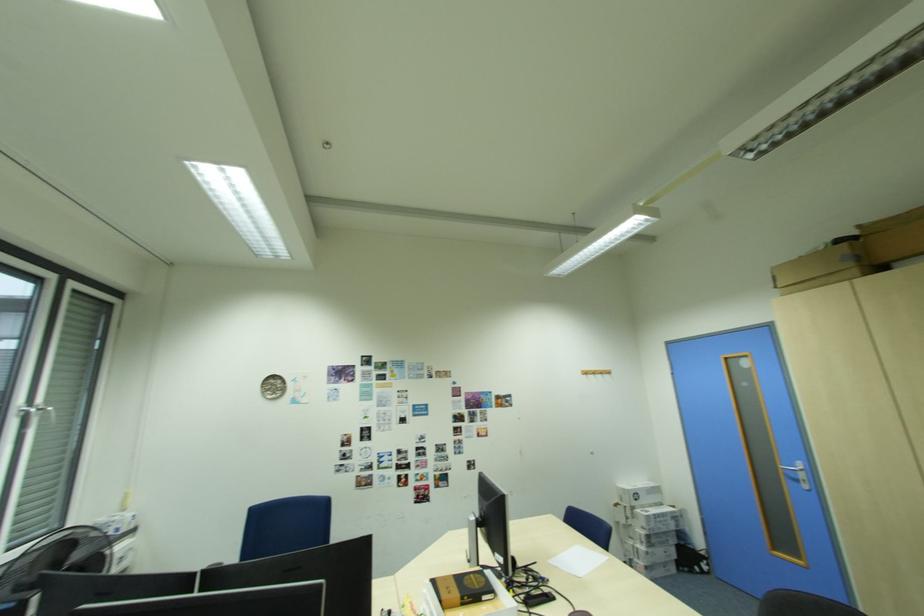
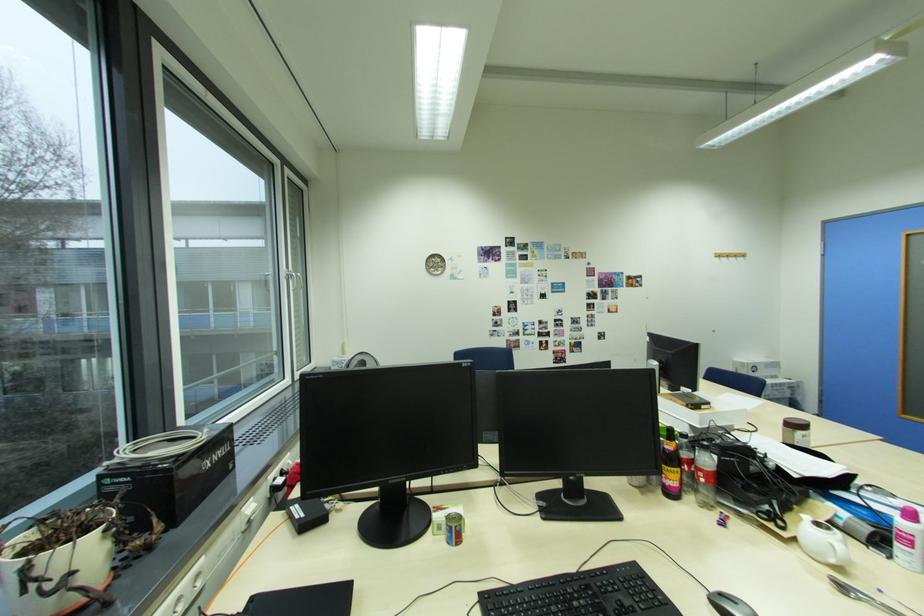
Where in the second image is the point corresponding to the point at 32,408 from the first image?

(296, 274)